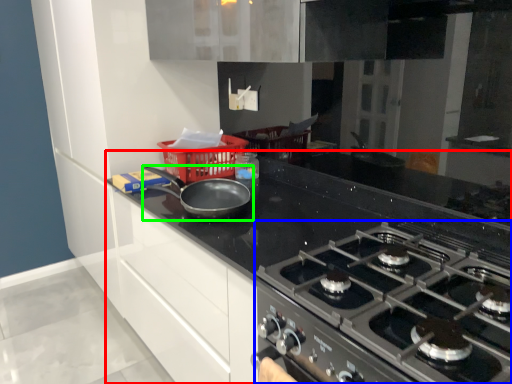
Question: Based on their relative distances, which object is farther from countertop (highlighted by a red box)? Choose from gas stove (highlighted by a blue box) and kitchen appliance (highlighted by a green box).

Choices:
 (A) gas stove
 (B) kitchen appliance

Answer: (B)